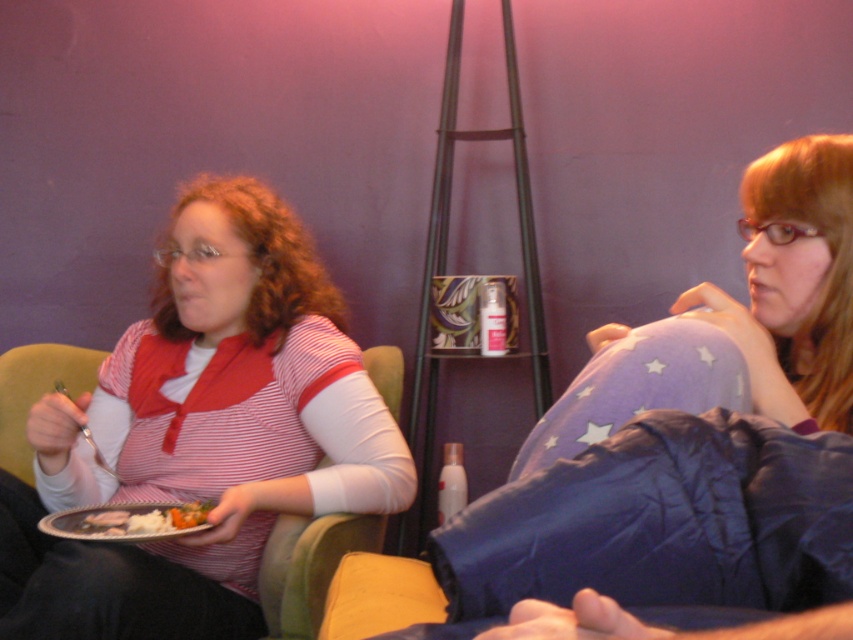
Question: Does matte striped shirt at left come behind white matte plate at lower left?

Choices:
 (A) no
 (B) yes

Answer: (A)

Question: Which of the following is the closest to the observer?

Choices:
 (A) (125, 520)
 (B) (3, 636)

Answer: (B)

Question: Is matte striped shirt at left closer to camera compared to white matte plate at lower left?

Choices:
 (A) no
 (B) yes

Answer: (B)

Question: Considering the relative positions of matte striped shirt at left and white matte plate at lower left in the image provided, where is matte striped shirt at left located with respect to white matte plate at lower left?

Choices:
 (A) left
 (B) right

Answer: (B)

Question: Which point appears farthest from the camera in this image?

Choices:
 (A) click(x=129, y=506)
 (B) click(x=195, y=291)

Answer: (B)